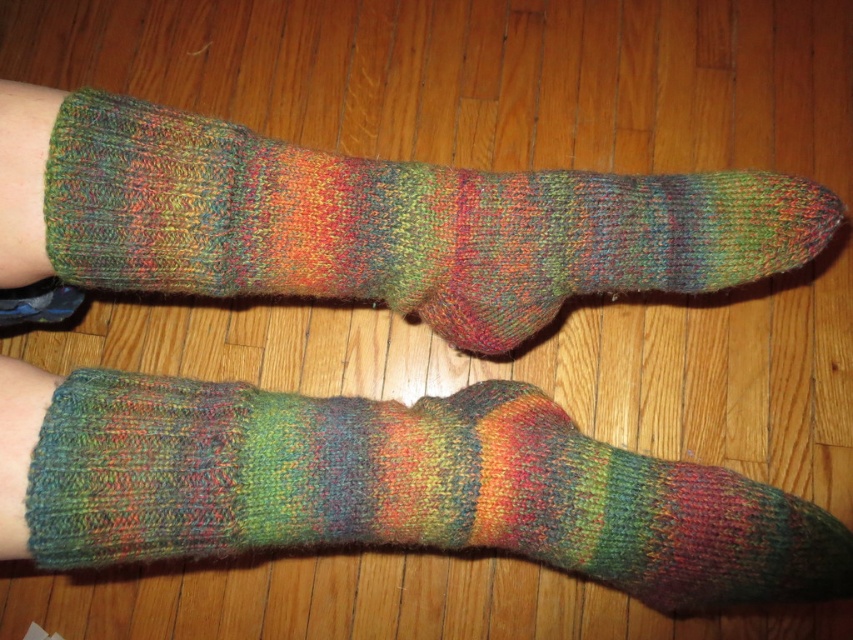
You are a photographer trying to capture the multicolored knitted sock at lower left in the image. If you want to position it exactly at the center of your camera frame, which has a coordinate system where the bottom left corner is at point 0,0 and the top right corner is at point 1,1, what adjustment should you make to the sock?

The multicolored knitted sock at lower left is currently at point (407, 488). To center it, move it to (426, 320) by adjusting its position along the x and y axes.

You are trying to pick up the multicolored knitted sock at upper center from the wooden floor. Can you grab it without moving the multicolored knitted sock at lower left first?

The multicolored knitted sock at lower left is in front of the multicolored knitted sock at upper center, so you need to move the sock at lower left first before you can reach the one at upper center.

You are organizing a sock drawer and need to know which sock is narrower between the multicolored knitted sock at lower left and the multicolored knitted sock at upper center. Which one should you choose?

The multicolored knitted sock at lower left has a lesser width compared to the multicolored knitted sock at upper center, so you should choose the multicolored knitted sock at lower left as it is narrower.